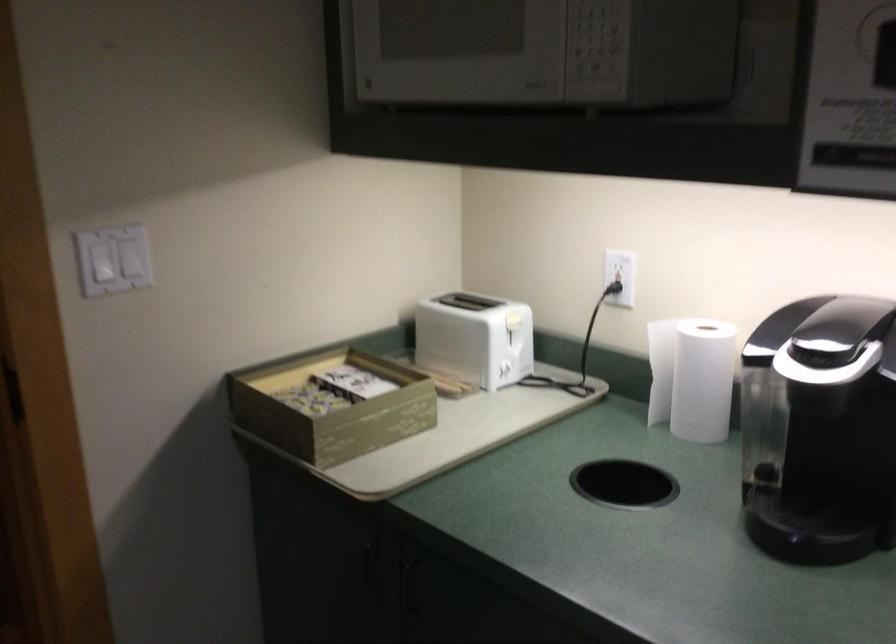
Find where to lift the coffee maker lid. Please return your answer as a coordinate pair (x, y).

(840, 330)